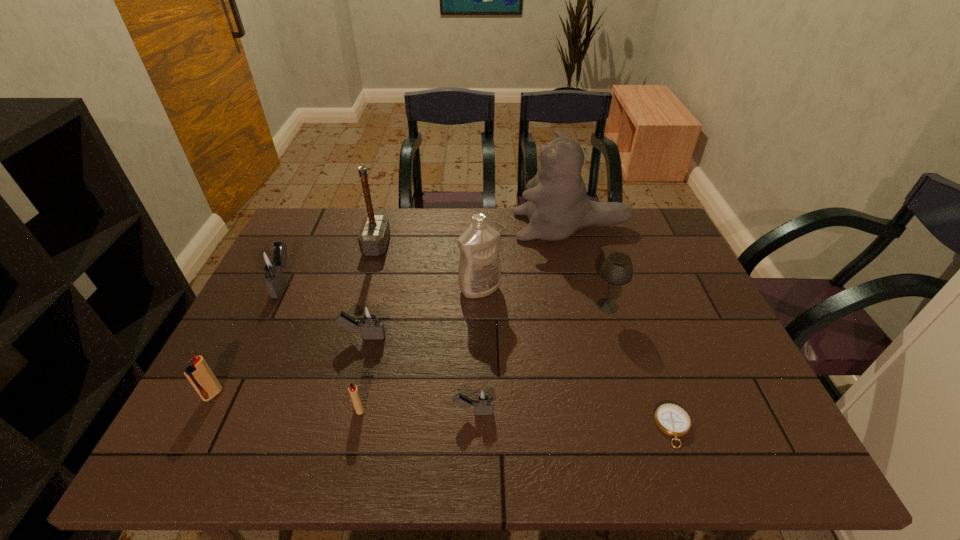
Choose which igniter is the third nearest neighbor to the rightmost gray igniter. Please provide its 2D coordinates. Your answer should be formatted as a tuple, i.e. [(x, y)], where the tuple contains the x and y coordinates of a point satisfying the conditions above.

[(199, 374)]

Locate which gray igniter is the closest to the white detergent. Please provide its 2D coordinates. Your answer should be formatted as a tuple, i.e. [(x, y)], where the tuple contains the x and y coordinates of a point satisfying the conditions above.

[(369, 318)]

Identify which gray igniter is the second nearest to the seventh farthest object. Please provide its 2D coordinates. Your answer should be formatted as a tuple, i.e. [(x, y)], where the tuple contains the x and y coordinates of a point satisfying the conditions above.

[(271, 262)]

Locate an element on the screen. vacant position in the image that satisfies the following two spatial constraints: 1. on the back side of the right red igniter; 2. on the right side of the detergent is located at coordinates (387, 289).

I want to click on free space that satisfies the following two spatial constraints: 1. on the striking surface of the second smallest gray igniter; 2. on the right side of the hammer, so click(350, 337).